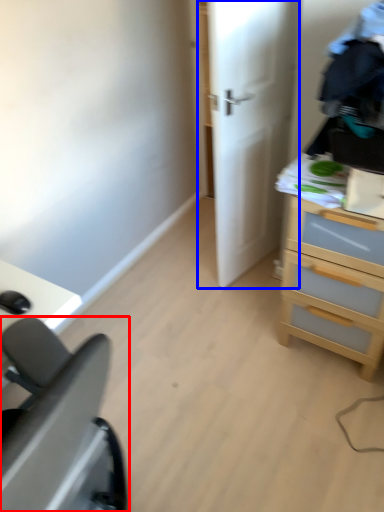
Question: Which object is closer to the camera taking this photo, furniture (highlighted by a red box) or door (highlighted by a blue box)?

Choices:
 (A) furniture
 (B) door

Answer: (A)